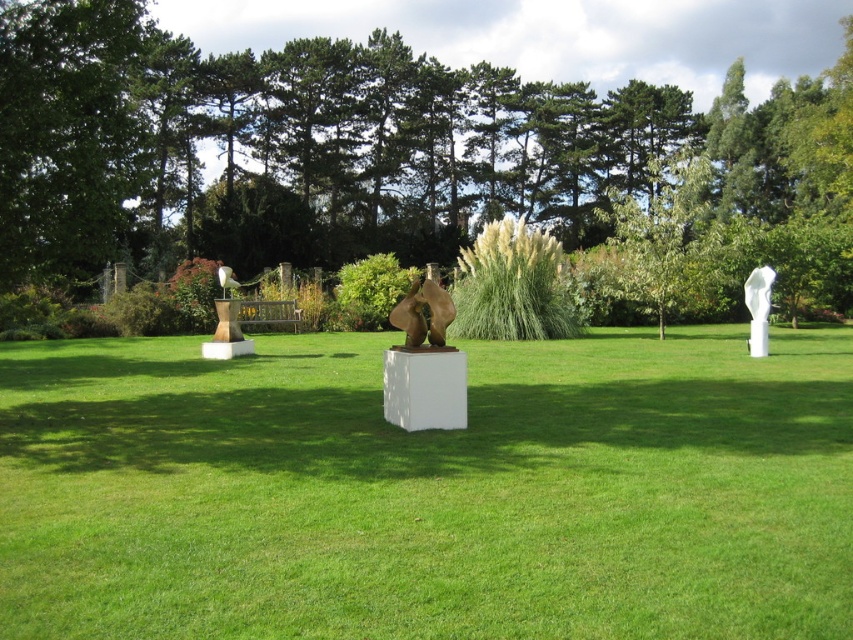
Question: Can you confirm if green grass at center is positioned to the right of green leafy tree at center?

Choices:
 (A) no
 (B) yes

Answer: (A)

Question: Which object is positioned closest to the white glossy statue at upper right?

Choices:
 (A) bronze sculpture at center
 (B) green grass at center
 (C) green leafy tree at center

Answer: (B)

Question: Which point is farther from the camera taking this photo?

Choices:
 (A) (538, 500)
 (B) (749, 333)
 (C) (416, 336)
 (D) (341, 38)

Answer: (D)

Question: Which of these objects is positioned closest to the green leafy tree at center?

Choices:
 (A) green grass at center
 (B) white glossy statue at upper right

Answer: (A)

Question: Does green grass at center have a greater width compared to green leafy tree at center?

Choices:
 (A) yes
 (B) no

Answer: (B)

Question: In this image, where is green grass at center located relative to white glossy statue at upper right?

Choices:
 (A) below
 (B) above

Answer: (A)